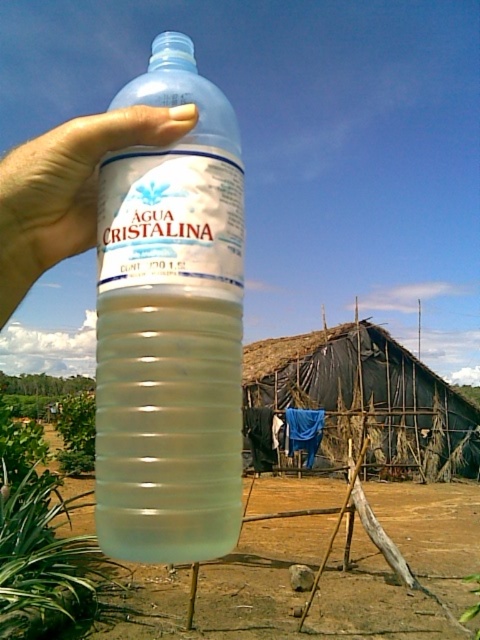
Question: Can you confirm if transparent plastic bottle at center is positioned to the left of transparent plastic hand at upper left?

Choices:
 (A) no
 (B) yes

Answer: (A)

Question: Is transparent plastic bottle at center thinner than translucent plastic dirt field at center?

Choices:
 (A) yes
 (B) no

Answer: (A)

Question: Estimate the real-world distances between objects in this image. Which object is farther from the translucent plastic dirt field at center?

Choices:
 (A) transparent plastic bottle at center
 (B) transparent plastic hand at upper left

Answer: (A)

Question: In this image, where is translucent plastic dirt field at center located relative to transparent plastic hand at upper left?

Choices:
 (A) below
 (B) above

Answer: (A)

Question: Which of the following is the closest to the observer?

Choices:
 (A) transparent plastic bottle at center
 (B) transparent plastic hand at upper left
 (C) translucent plastic dirt field at center

Answer: (A)

Question: Which point appears closest to the camera in this image?

Choices:
 (A) (357, 582)
 (B) (181, 204)

Answer: (B)